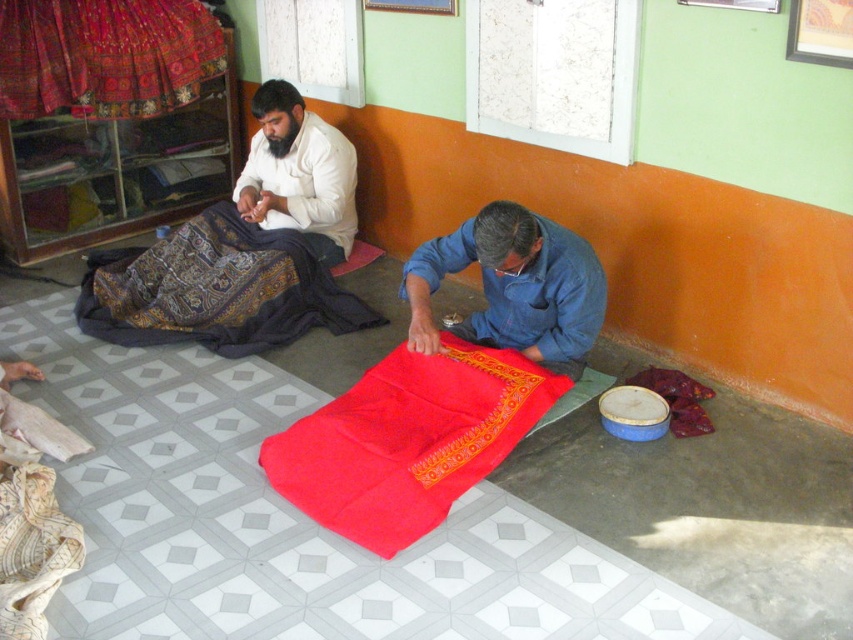
You are a tailor who needs to determine if the matte red fabric at center can be folded to fit into a storage box designed for items no wider than the denim shirt at lower center. Based on the scene, can the fabric be folded to fit?

The matte red fabric at center is wider than the denim shirt at lower center, so it can be folded to fit into the storage box designed for items no wider than the denim shirt at lower center.